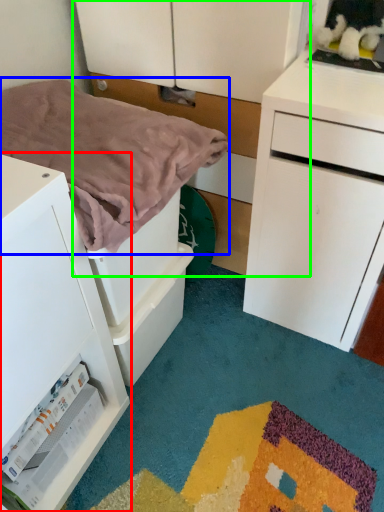
Question: Considering the real-world distances, which object is farthest from chest of drawers (highlighted by a red box)? blanket (highlighted by a blue box) or dresser (highlighted by a green box)?

Choices:
 (A) blanket
 (B) dresser

Answer: (B)